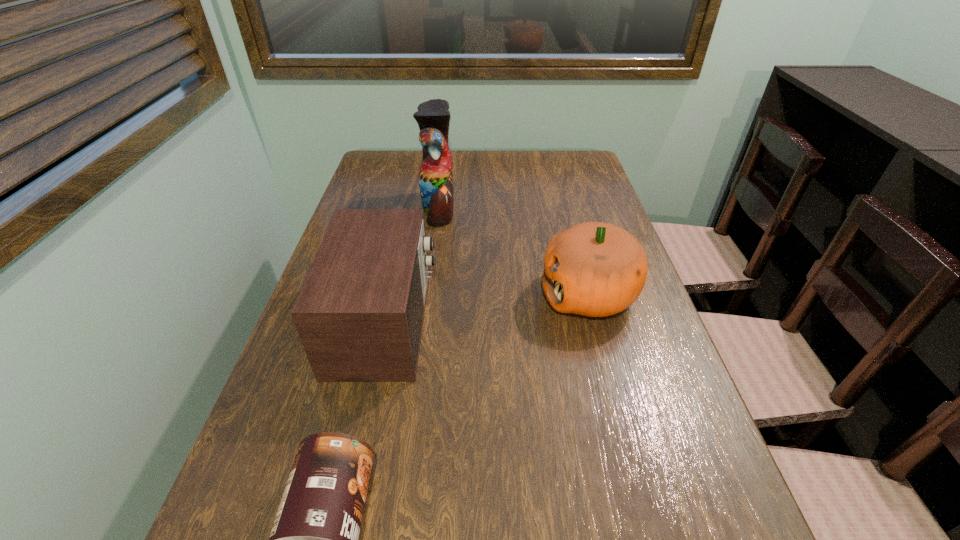
I want to click on object identified as the third closest to the pumpkin, so click(x=314, y=539).

Find the location of a particular element. The width and height of the screenshot is (960, 540). object that can be found as the second closest to the radio receiver is located at coordinates (435, 177).